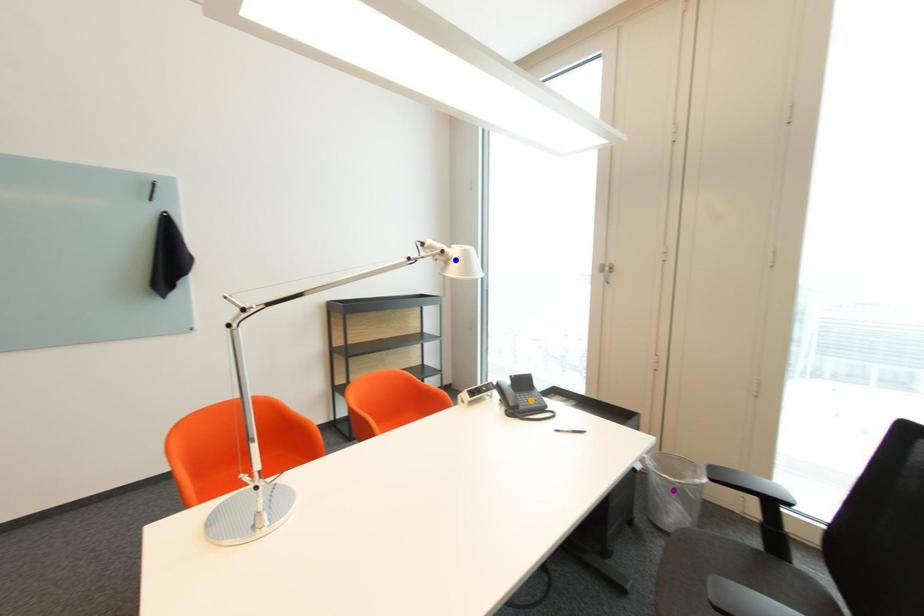
Based on the photo, order these from nearest to farthest:
blue point
purple point
orange point

blue point → orange point → purple point